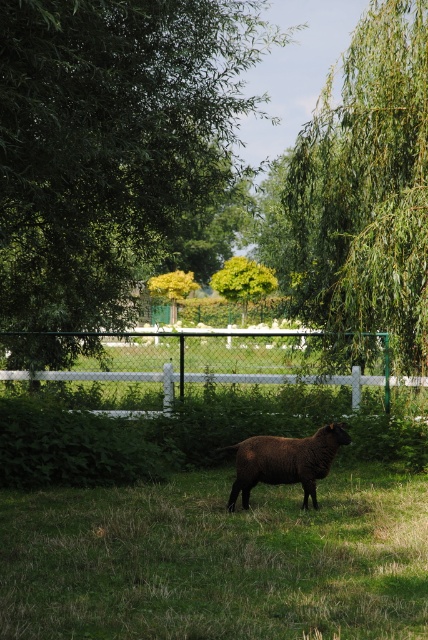
Question: Which object is closer to the camera taking this photo?

Choices:
 (A) white wooden fence at center
 (B) brown woolly sheep at center
 (C) green leafy tree at upper center
 (D) green leafy willow at upper right

Answer: (C)

Question: Which object appears farthest from the camera in this image?

Choices:
 (A) white wooden fence at center
 (B) green leafy willow at upper right

Answer: (A)

Question: Estimate the real-world distances between objects in this image. Which object is closer to the green leafy willow at upper right?

Choices:
 (A) white wooden fence at center
 (B) green leafy tree at upper center
 (C) brown woolly sheep at center

Answer: (A)

Question: Can you confirm if green leafy willow at upper right is positioned above brown woolly sheep at center?

Choices:
 (A) no
 (B) yes

Answer: (B)

Question: Does white wooden fence at center appear under brown woolly sheep at center?

Choices:
 (A) yes
 (B) no

Answer: (B)

Question: Where is white wooden fence at center located in relation to brown woolly sheep at center in the image?

Choices:
 (A) left
 (B) right

Answer: (A)